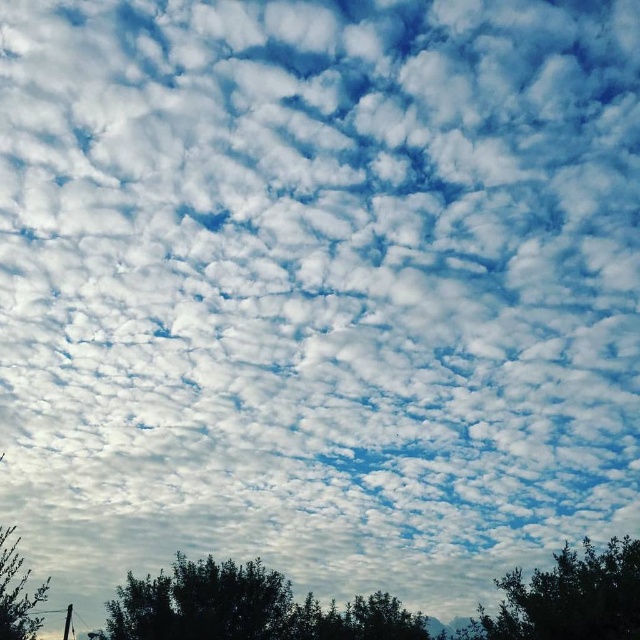
Question: Which point is closer to the camera?

Choices:
 (A) (328, 637)
 (B) (20, 609)
 (C) (586, 556)

Answer: (B)

Question: Which point is farther to the camera?

Choices:
 (A) green leafy tree at lower right
 (B) green leafy tree at lower left
 (C) green leafy tree at lower center

Answer: (C)

Question: Can you confirm if green leafy tree at lower right is positioned above green leafy tree at lower left?

Choices:
 (A) yes
 (B) no

Answer: (B)

Question: Is green leafy tree at lower right below green leafy tree at lower left?

Choices:
 (A) yes
 (B) no

Answer: (A)

Question: Does green leafy tree at lower center appear on the left side of green leafy tree at lower left?

Choices:
 (A) no
 (B) yes

Answer: (A)

Question: Which object appears farthest from the camera in this image?

Choices:
 (A) green leafy tree at lower right
 (B) green leafy tree at lower center

Answer: (B)